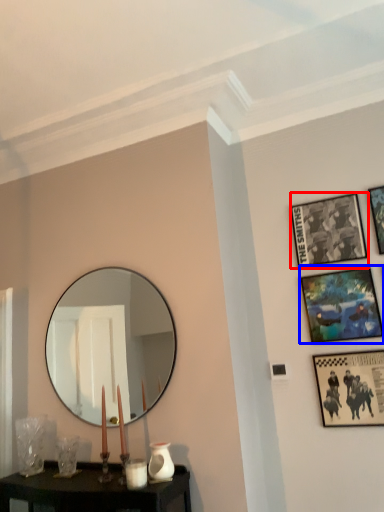
Question: Which object is closer to the camera taking this photo, picture frame (highlighted by a red box) or picture frame (highlighted by a blue box)?

Choices:
 (A) picture frame
 (B) picture frame

Answer: (B)